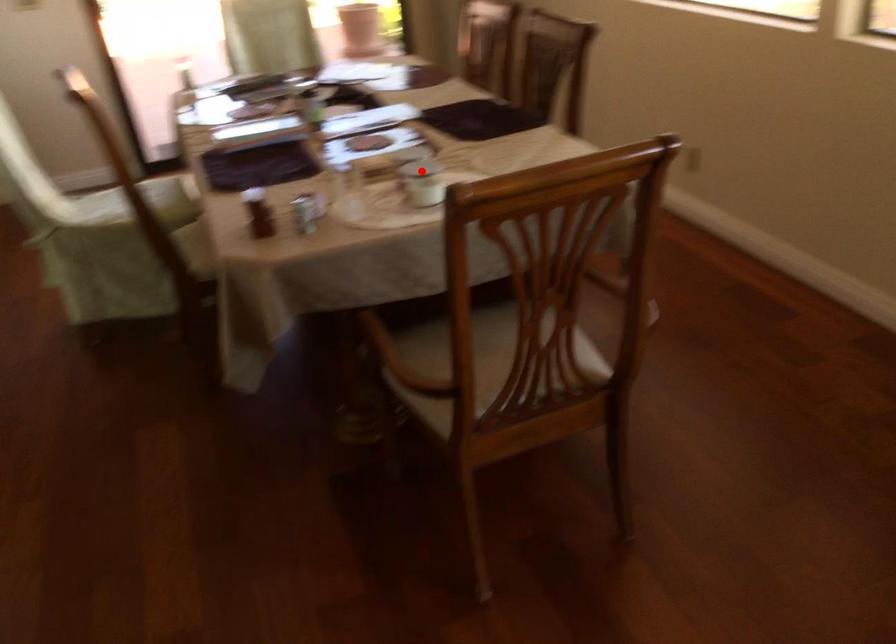
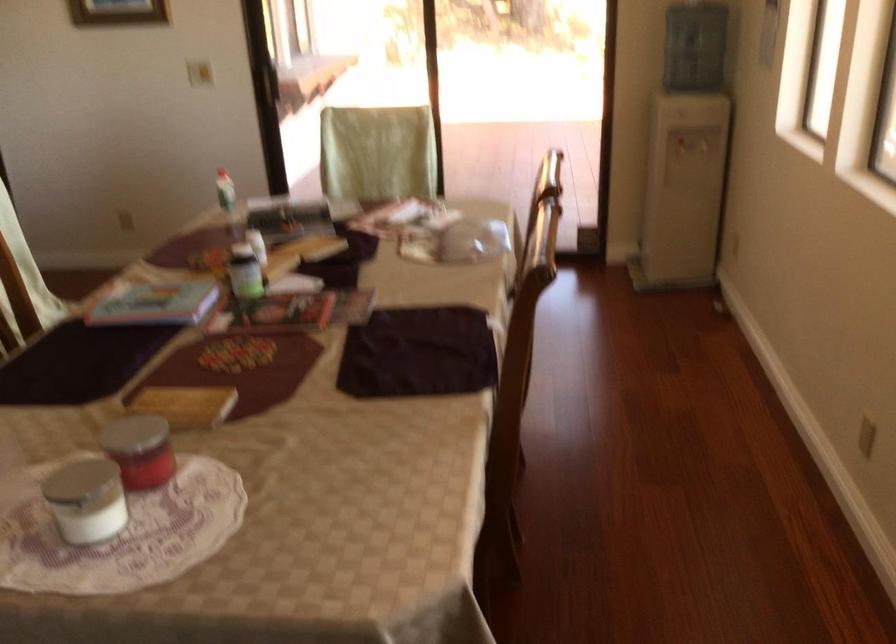
In the second image, find the point that corresponds to the highlighted location in the first image.

(162, 465)